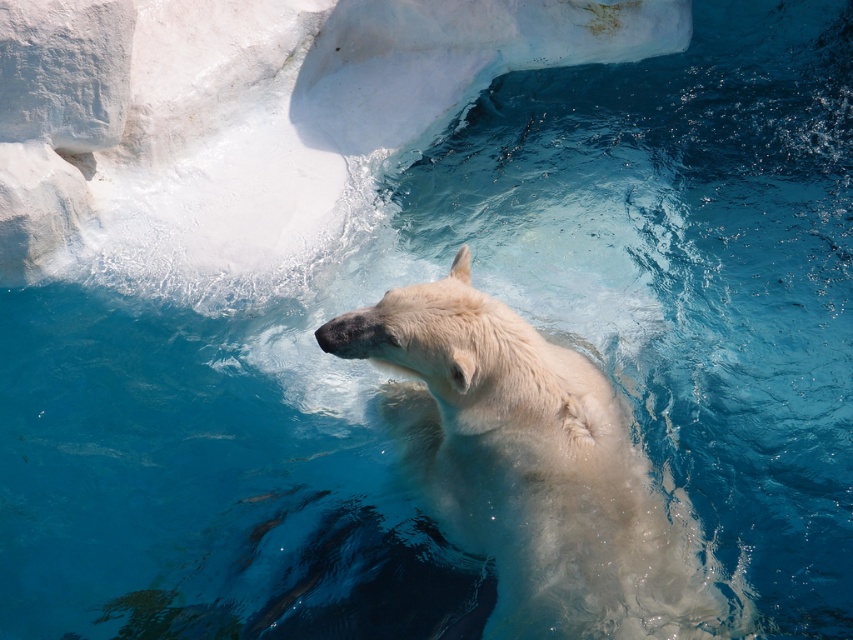
Who is shorter, white fur bear at center or white smooth rock at upper left?

Standing shorter between the two is white smooth rock at upper left.

Is white fur bear at center bigger than white smooth rock at upper left?

Indeed, white fur bear at center has a larger size compared to white smooth rock at upper left.

Find the location of a particular element. white fur bear at center is located at coordinates (529, 465).

At what (x,y) coordinates should I click in order to perform the action: click on white fur bear at center. Please return your answer as a coordinate pair (x, y). The width and height of the screenshot is (853, 640). Looking at the image, I should click on (529, 465).